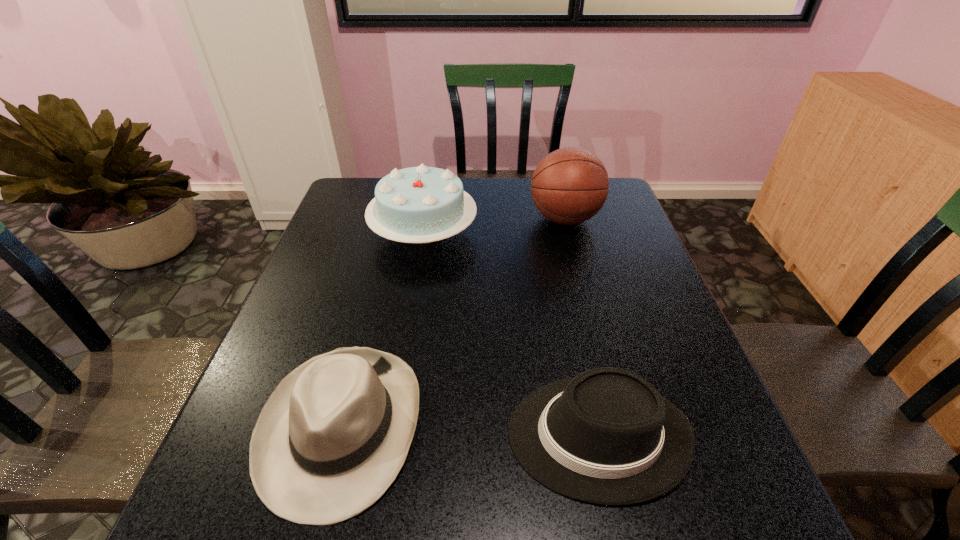
Image resolution: width=960 pixels, height=540 pixels. What are the coordinates of `free space between the left fedora and the right fedora` in the screenshot? It's located at (469, 431).

Where is `free space that is in between the basketball and the right fedora`? The width and height of the screenshot is (960, 540). free space that is in between the basketball and the right fedora is located at coordinates (582, 327).

Where is `vacant area that lies between the basketball and the right fedora`? This screenshot has height=540, width=960. vacant area that lies between the basketball and the right fedora is located at coordinates (582, 327).

The width and height of the screenshot is (960, 540). In order to click on free space that is in between the second tallest object and the right fedora in this screenshot , I will do click(511, 334).

Select which object is the third closest to the right fedora. Please provide its 2D coordinates. Your answer should be formatted as a tuple, i.e. [(x, y)], where the tuple contains the x and y coordinates of a point satisfying the conditions above.

[(569, 186)]

The image size is (960, 540). What are the coordinates of `object that ranks as the second closest to the right fedora` in the screenshot? It's located at click(x=422, y=204).

Image resolution: width=960 pixels, height=540 pixels. What are the coordinates of `vacant area that satisfies the following two spatial constraints: 1. on the back side of the third shortest object; 2. on the right side of the basketball` in the screenshot? It's located at (426, 219).

Where is `vacant position in the image that satisfies the following two spatial constraints: 1. on the back side of the basketball; 2. on the left side of the birthday cake`? vacant position in the image that satisfies the following two spatial constraints: 1. on the back side of the basketball; 2. on the left side of the birthday cake is located at coordinates (426, 219).